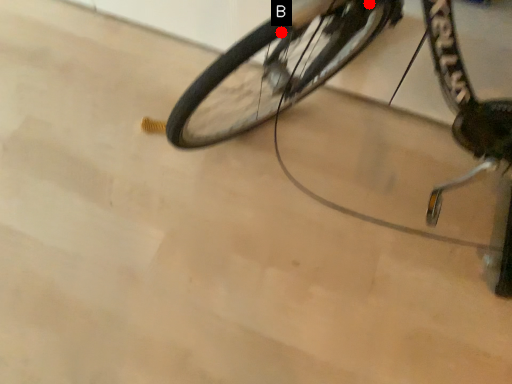
Question: Two points are circled on the image, labeled by A and B beside each circle. Among these points, which one is nearest to the camera?

Choices:
 (A) A is closer
 (B) B is closer

Answer: (B)